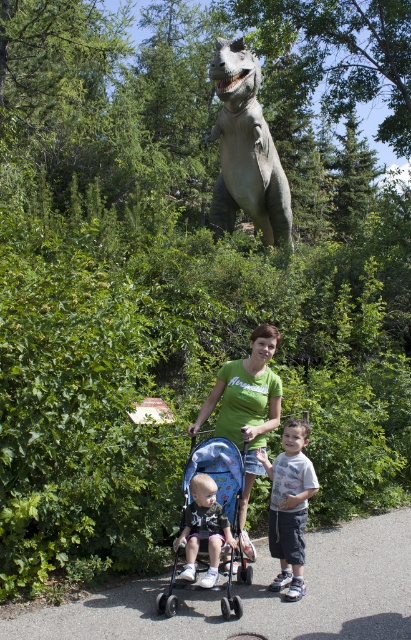
You are a parent trying to push both the blue fabric stroller at center and the matte black stroller at center through a narrow doorway. Which stroller should you push first to ensure both can fit through the doorway?

The blue fabric stroller at center is positioned under the matte black stroller at center, so you should push the matte black stroller at center first to allow the blue fabric stroller at center to follow underneath.

You are standing at point (x=260, y=596) in the image. What is the material of the ground beneath your feet?

The ground beneath your feet at point (x=260, y=596) is gray asphalt path at center.